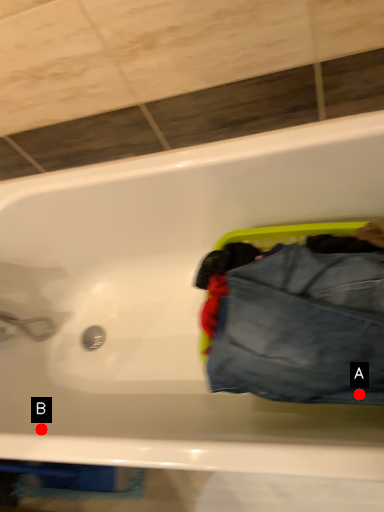
Question: Two points are circled on the image, labeled by A and B beside each circle. Which of the following is the closest to the observer?

Choices:
 (A) A is closer
 (B) B is closer

Answer: (A)